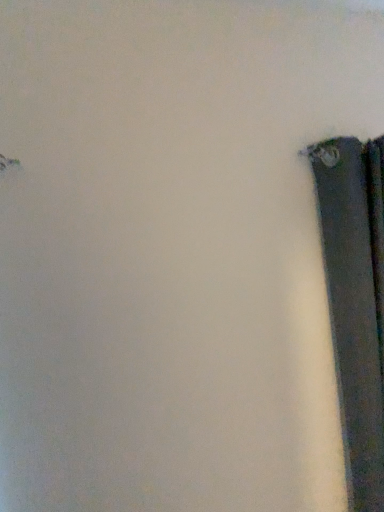
You are a GUI agent. You are given a task and a screenshot of the screen. Output one action in this format:
    pyautogui.click(x=<x>, y=<y>)
    Task: Click on the matte black book at right
    This screenshot has height=512, width=384.
    Given the screenshot: What is the action you would take?
    pyautogui.click(x=356, y=301)

What do you see at coordinates (356, 301) in the screenshot?
I see `matte black book at right` at bounding box center [356, 301].

Find the location of `matte black book at right`. matte black book at right is located at coordinates (356, 301).